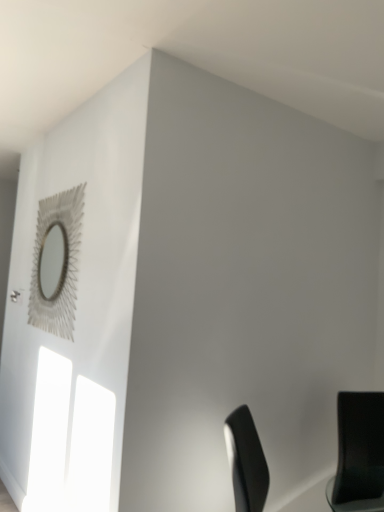
Question: Is point (354, 501) positioned closer to the camera than point (56, 297)?

Choices:
 (A) closer
 (B) farther

Answer: (A)

Question: Is black matte chair at lower right in front of or behind metallic silver mirror at upper left in the image?

Choices:
 (A) behind
 (B) front

Answer: (B)

Question: From their relative heights in the image, would you say black matte chair at lower right is taller or shorter than metallic silver mirror at upper left?

Choices:
 (A) short
 (B) tall

Answer: (A)

Question: Is metallic silver mirror at upper left situated inside black matte chair at lower right or outside?

Choices:
 (A) inside
 (B) outside

Answer: (B)

Question: Considering their positions, is metallic silver mirror at upper left located in front of or behind black matte chair at lower right?

Choices:
 (A) front
 (B) behind

Answer: (B)

Question: In terms of size, does metallic silver mirror at upper left appear bigger or smaller than black matte chair at lower right?

Choices:
 (A) small
 (B) big

Answer: (A)

Question: From the image's perspective, relative to black matte chair at lower right, is metallic silver mirror at upper left above or below?

Choices:
 (A) below
 (B) above

Answer: (B)